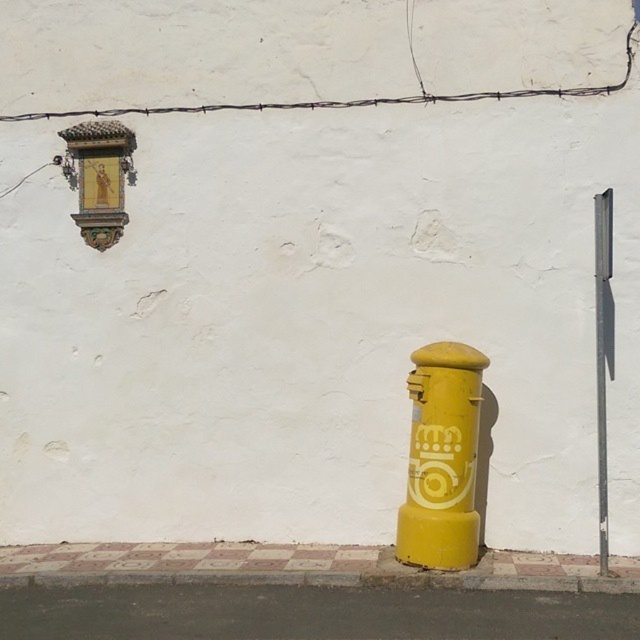
Question: Which of these objects is positioned closest to the yellow concrete curb at lower center?

Choices:
 (A) smooth metallic pole at right
 (B) yellow matte postbox at center
 (C) smooth asphalt pavement at lower center

Answer: (C)

Question: Among these points, which one is nearest to the camera?

Choices:
 (A) (596, 218)
 (B) (428, 369)
 (C) (250, 577)
 (D) (291, 634)

Answer: (D)

Question: Does yellow matte postbox at center have a greater width compared to yellow concrete curb at lower center?

Choices:
 (A) no
 (B) yes

Answer: (A)

Question: Can you confirm if yellow matte postbox at center is positioned above yellow concrete curb at lower center?

Choices:
 (A) yes
 (B) no

Answer: (A)

Question: Considering the relative positions of yellow matte postbox at center and yellow concrete curb at lower center in the image provided, where is yellow matte postbox at center located with respect to yellow concrete curb at lower center?

Choices:
 (A) left
 (B) right

Answer: (B)

Question: Which point is closer to the camera?

Choices:
 (A) (476, 419)
 (B) (74, 582)

Answer: (B)